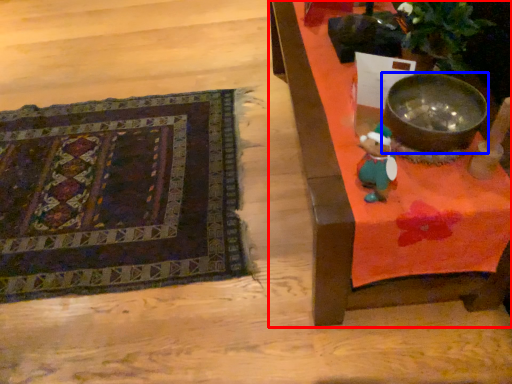
Question: Which point is closer to the camera, furniture (highlighted by a red box) or mixing bowl (highlighted by a blue box)?

Choices:
 (A) furniture
 (B) mixing bowl

Answer: (A)